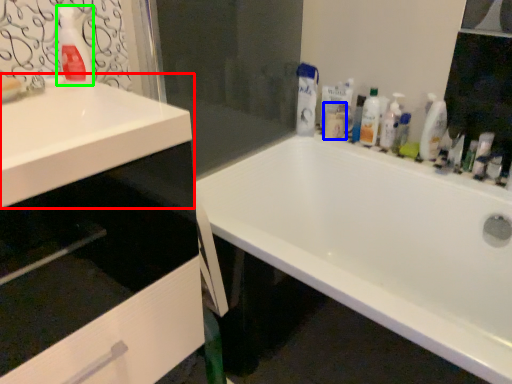
Question: Which object is the farthest from sink (highlighted by a red box)? Choose among these: toiletry (highlighted by a blue box) or cleaning product (highlighted by a green box).

Choices:
 (A) toiletry
 (B) cleaning product

Answer: (A)